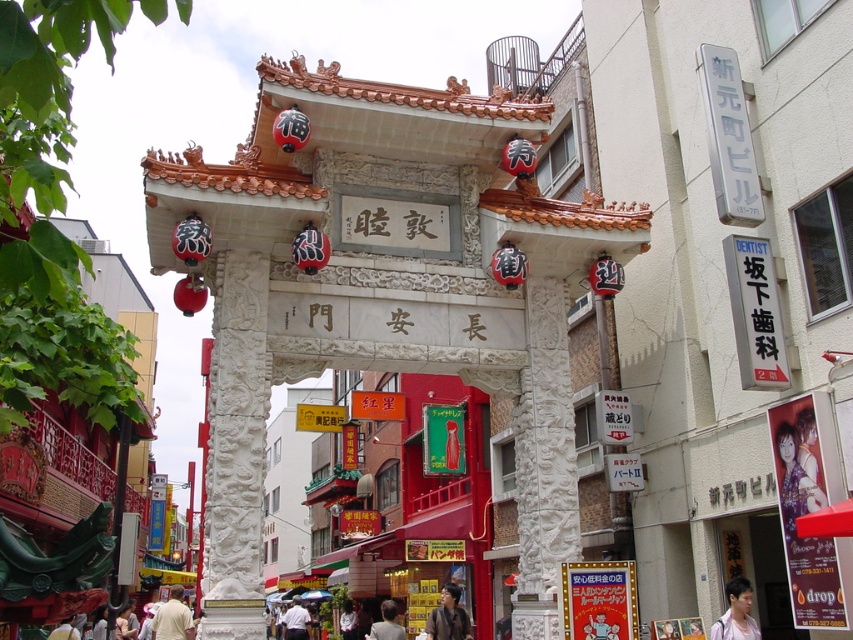
Question: Which of the following is the farthest from the observer?

Choices:
 (A) light beige shirt at lower center
 (B) matte purple shirt at lower right

Answer: (A)

Question: Estimate the real-world distances between objects in this image. Which object is closer to the light brown hair at center?

Choices:
 (A) light beige shirt at lower center
 (B) smooth black hair at center
 (C) matte purple shirt at lower right
 (D) white shirt at center

Answer: (B)

Question: Does matte purple shirt at lower right have a greater width compared to light beige shirt at lower center?

Choices:
 (A) yes
 (B) no

Answer: (B)

Question: Can you confirm if matte purple shirt at lower right is bigger than smooth black hair at center?

Choices:
 (A) yes
 (B) no

Answer: (B)

Question: Estimate the real-world distances between objects in this image. Which object is closer to the white shirt at center?

Choices:
 (A) light beige shirt at lower center
 (B) matte purple shirt at lower right
 (C) smooth black hair at center
 (D) light brown hair at center

Answer: (D)

Question: Does light beige shirt at lower center have a lesser width compared to white shirt at center?

Choices:
 (A) yes
 (B) no

Answer: (B)